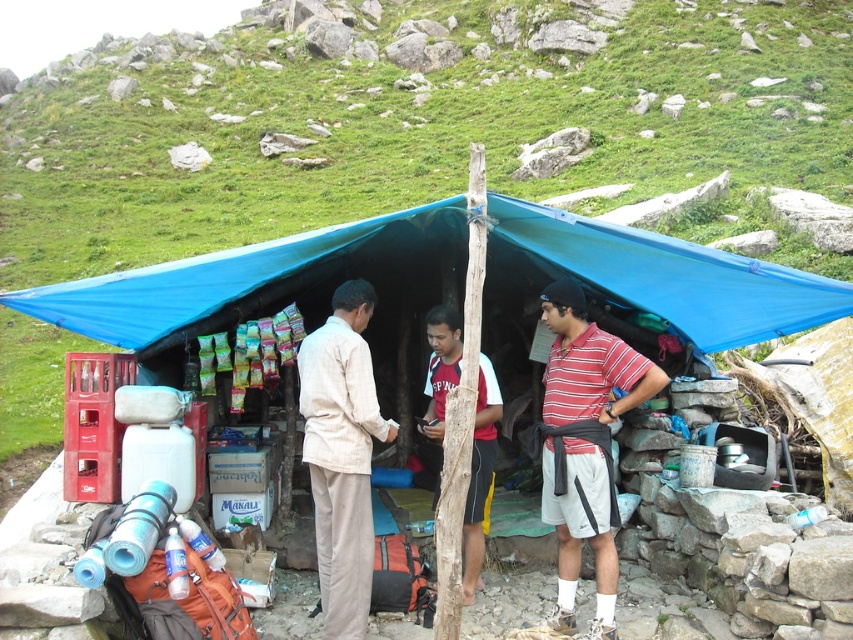
You are a hiker passing by the mountain stall. You see the blue tarp at center and the striped cotton polo shirt at center. Which object is positioned more to the right from your viewpoint?

The blue tarp at center is positioned to the right of the striped cotton polo shirt at center, so the blue tarp at center is more to the right.

Consider the image. What is the 2D coordinate of the blue tarp at center in the image?

The blue tarp at center is located at the 2D coordinate point of (663,273).